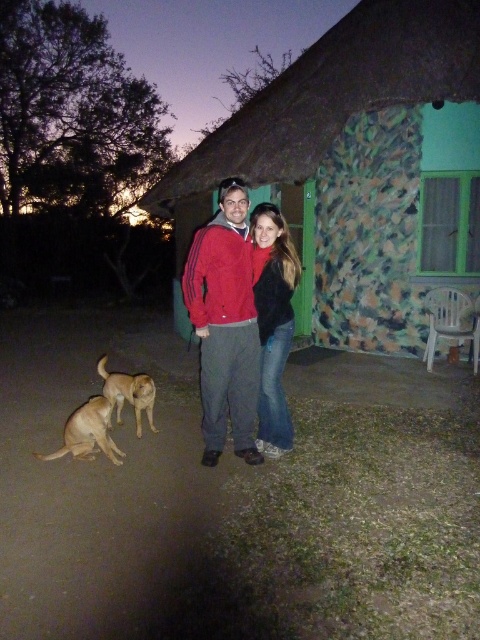
Who is shorter, brown furry dog at lower left or golden fur dog at lower left?

brown furry dog at lower left is shorter.

Can you confirm if brown furry dog at lower left is smaller than golden fur dog at lower left?

Correct, brown furry dog at lower left occupies less space than golden fur dog at lower left.

You are a GUI agent. You are given a task and a screenshot of the screen. Output one action in this format:
    pyautogui.click(x=<x>, y=<y>)
    Task: Click on the brown furry dog at lower left
    Image resolution: width=480 pixels, height=640 pixels.
    Given the screenshot: What is the action you would take?
    pyautogui.click(x=87, y=433)

Is point (368, 237) positioned before point (90, 458)?

No, it is behind (90, 458).

Can you confirm if camouflage stucco hut at center is positioned to the left of brown furry dog at lower left?

In fact, camouflage stucco hut at center is to the right of brown furry dog at lower left.

This screenshot has width=480, height=640. Describe the element at coordinates (360, 168) in the screenshot. I see `camouflage stucco hut at center` at that location.

Locate an element on the screen. Image resolution: width=480 pixels, height=640 pixels. camouflage stucco hut at center is located at coordinates (360, 168).

Can you confirm if matte black jacket at center is shorter than golden fur dog at lower left?

Incorrect, matte black jacket at center's height does not fall short of golden fur dog at lower left's.

Which is in front, point (284, 438) or point (104, 376)?

Point (284, 438)

Find the location of `matte black jacket at center`. matte black jacket at center is located at coordinates (273, 321).